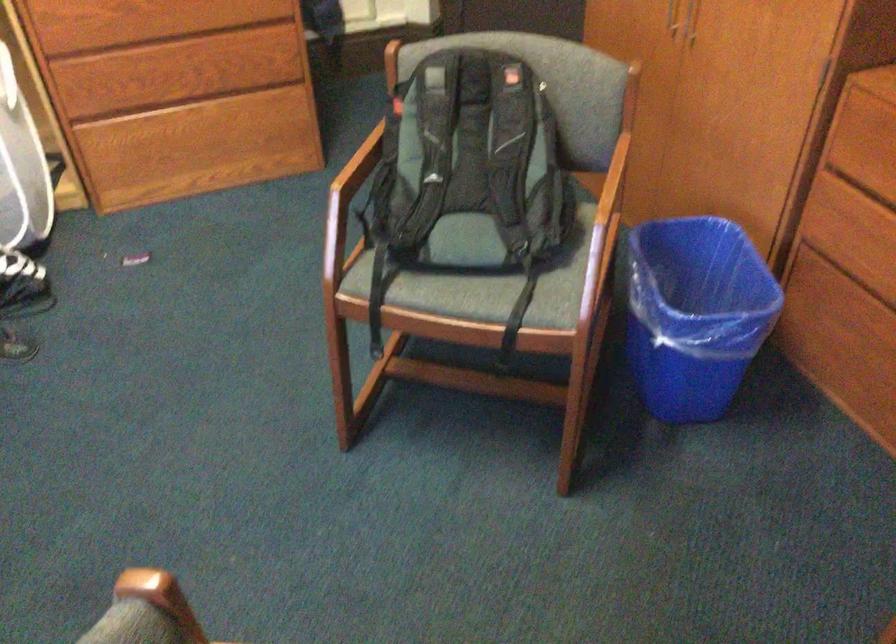
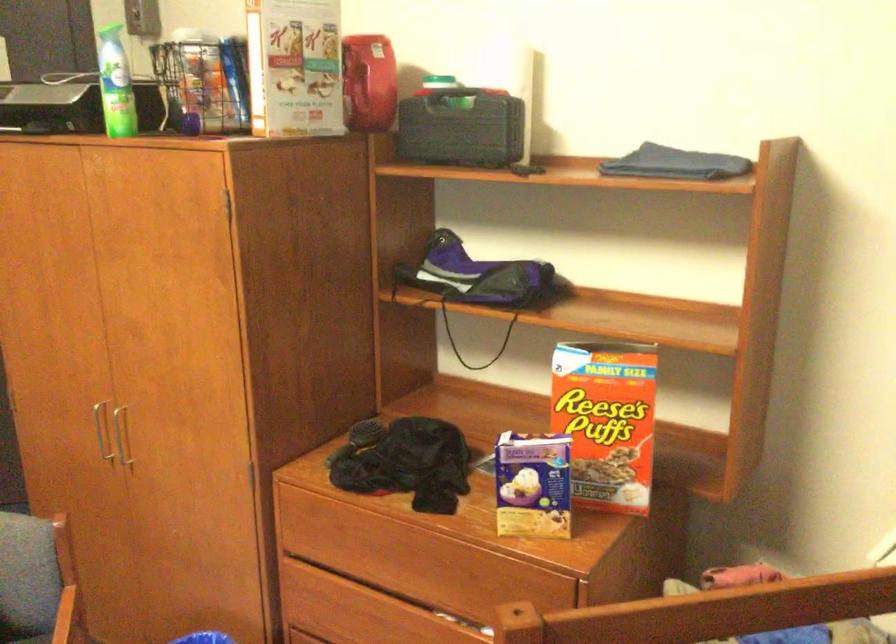
The images are taken continuously from a first-person perspective. In which direction is your viewpoint rotating?

The rotation direction of the camera is right-up.